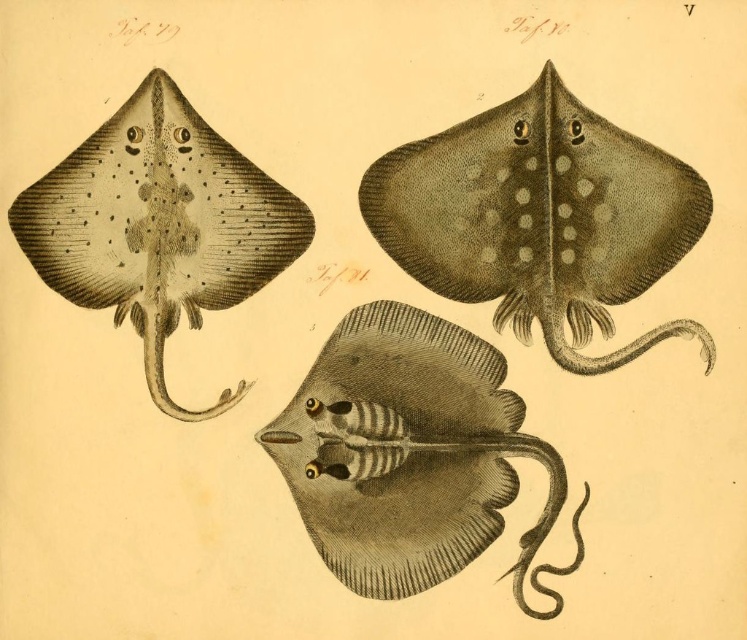
Question: Is brown dotted stingray at upper right in front of black textured stingray at upper left?

Choices:
 (A) yes
 (B) no

Answer: (A)

Question: Can you confirm if brown dotted stingray at upper right is wider than black textured stingray at upper left?

Choices:
 (A) no
 (B) yes

Answer: (B)

Question: Estimate the real-world distances between objects in this image. Which object is farther from the brown dotted stingray at upper right?

Choices:
 (A) gray striped stingray at center
 (B) black textured stingray at upper left

Answer: (B)

Question: Considering the real-world distances, which object is closest to the black textured stingray at upper left?

Choices:
 (A) brown dotted stingray at upper right
 (B) gray striped stingray at center

Answer: (B)

Question: Can you confirm if black textured stingray at upper left is smaller than gray striped stingray at center?

Choices:
 (A) no
 (B) yes

Answer: (A)

Question: Which object is positioned farthest from the gray striped stingray at center?

Choices:
 (A) black textured stingray at upper left
 (B) brown dotted stingray at upper right

Answer: (A)